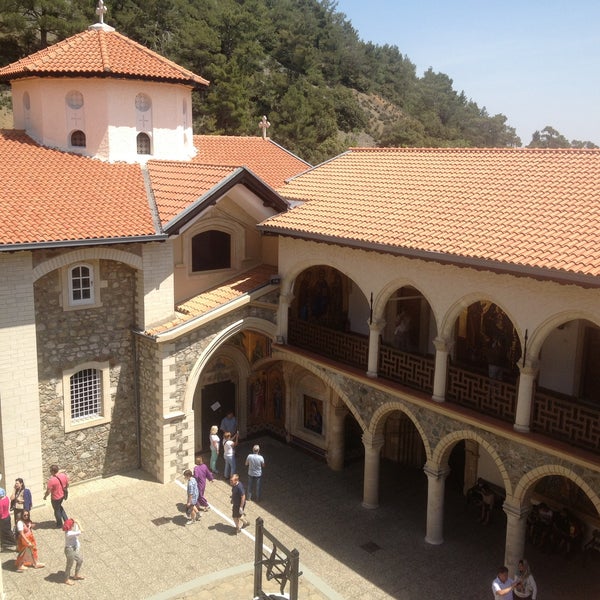
At what (x,y) coordinates should I click in order to perform the action: click on windows. Please return your answer as a coordinate pair (x, y). The image size is (600, 600). Looking at the image, I should click on (31, 100), (78, 141), (77, 98), (143, 103), (148, 142), (185, 139), (185, 109), (83, 284), (85, 405), (218, 247).